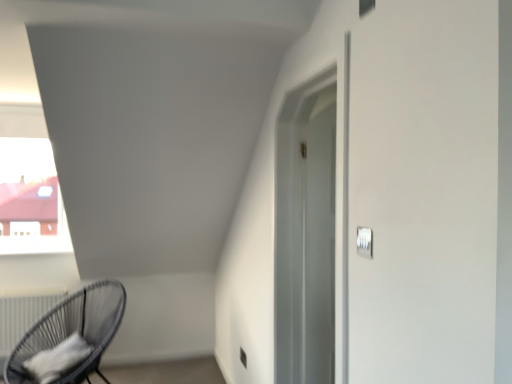
Question: Should I look upward or downward to see satin silver outlet at lower center?

Choices:
 (A) down
 (B) up

Answer: (A)

Question: Are black wicker chair at lower left and white plastic light switch at upper right far apart?

Choices:
 (A) no
 (B) yes

Answer: (B)

Question: Does black wicker chair at lower left have a greater height compared to white plastic light switch at upper right?

Choices:
 (A) yes
 (B) no

Answer: (A)

Question: Does black wicker chair at lower left have a lesser height compared to white plastic light switch at upper right?

Choices:
 (A) no
 (B) yes

Answer: (A)

Question: Is black wicker chair at lower left bigger than white plastic light switch at upper right?

Choices:
 (A) no
 (B) yes

Answer: (B)

Question: Does black wicker chair at lower left have a smaller size compared to white plastic light switch at upper right?

Choices:
 (A) yes
 (B) no

Answer: (B)

Question: Is black wicker chair at lower left at the left side of white plastic light switch at upper right?

Choices:
 (A) yes
 (B) no

Answer: (A)

Question: Is white plastic light switch at upper right facing towards white matte radiator at lower left?

Choices:
 (A) no
 (B) yes

Answer: (A)

Question: Is white plastic light switch at upper right positioned with its back to white matte radiator at lower left?

Choices:
 (A) yes
 (B) no

Answer: (B)

Question: Does white plastic light switch at upper right have a lesser width compared to white matte radiator at lower left?

Choices:
 (A) no
 (B) yes

Answer: (B)

Question: Considering the relative sizes of white plastic light switch at upper right and white matte radiator at lower left in the image provided, is white plastic light switch at upper right shorter than white matte radiator at lower left?

Choices:
 (A) yes
 (B) no

Answer: (A)

Question: Would you consider white plastic light switch at upper right to be distant from white matte radiator at lower left?

Choices:
 (A) yes
 (B) no

Answer: (A)

Question: From the image's perspective, is white plastic light switch at upper right located beneath white matte radiator at lower left?

Choices:
 (A) yes
 (B) no

Answer: (B)

Question: Can you confirm if black wicker chair at lower left is wider than satin silver outlet at lower center?

Choices:
 (A) yes
 (B) no

Answer: (A)